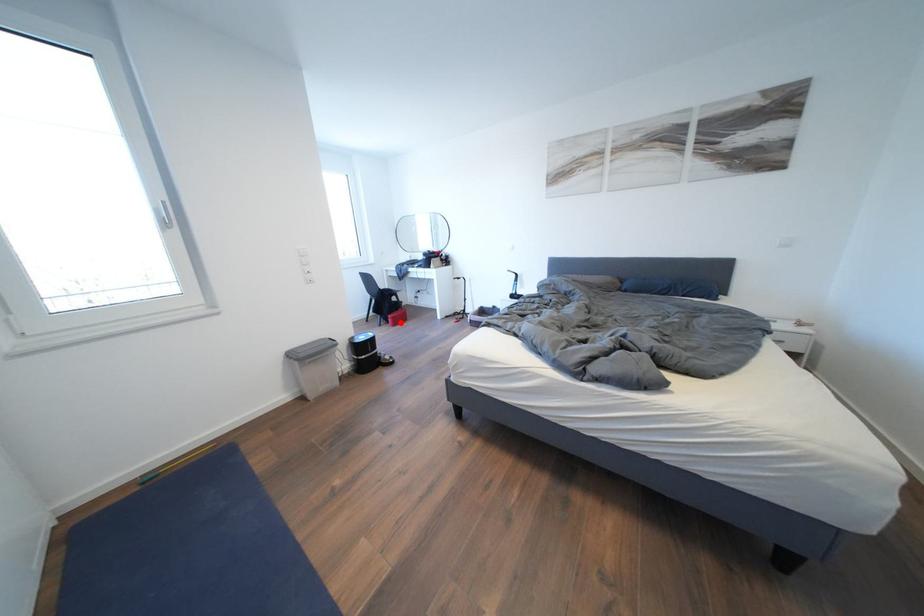
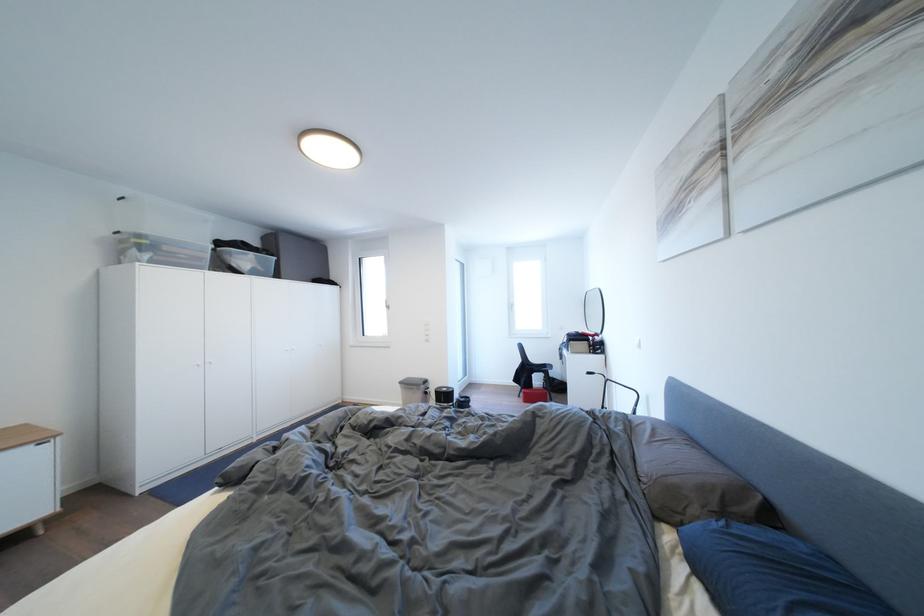
Find the pixel in the second image that matches the highlighted location in the first image.

(532, 398)